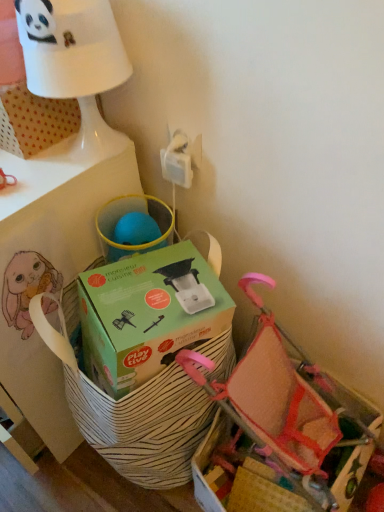
Where is `free region under white glossy table lamp at upper left (from a real-world perspective)`? free region under white glossy table lamp at upper left (from a real-world perspective) is located at coordinates (92, 151).